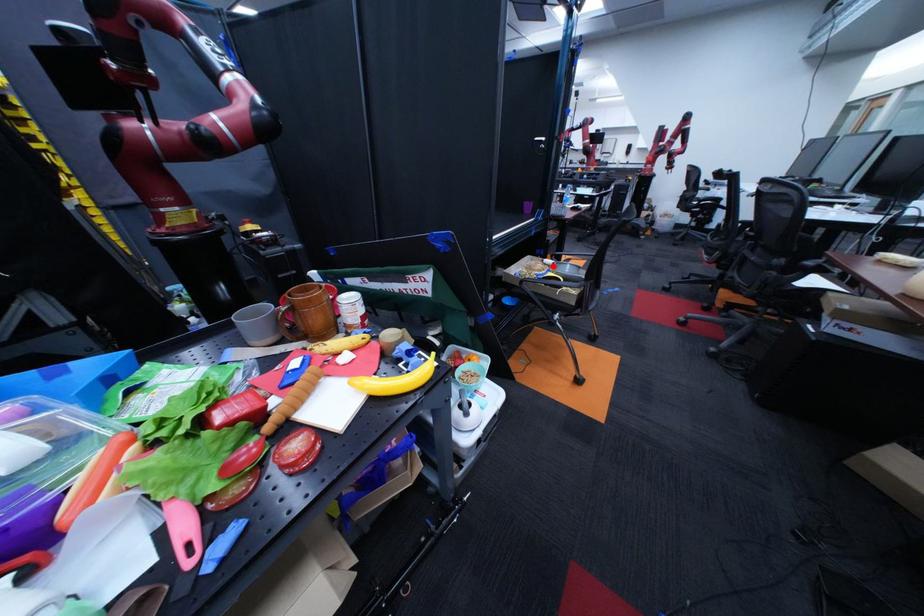
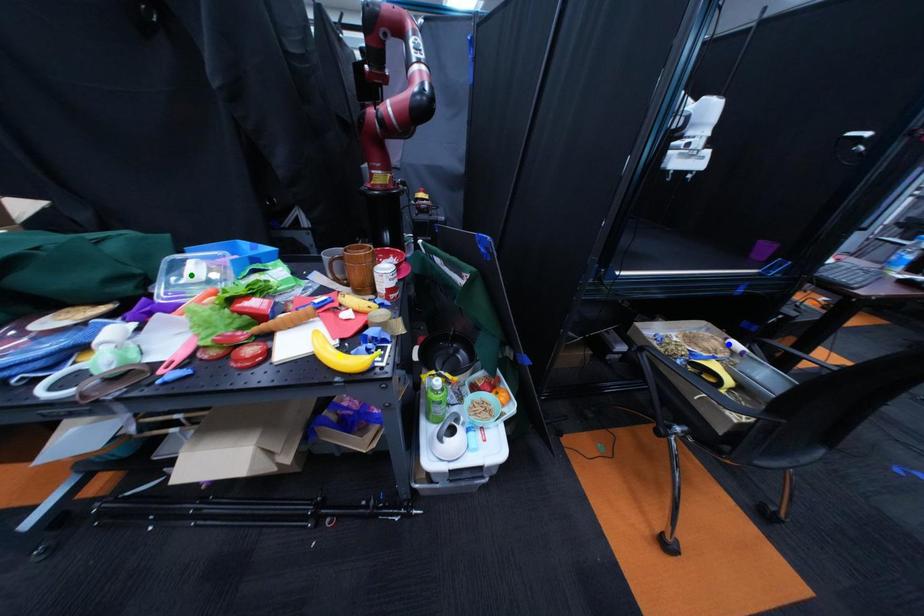
Question: I am providing you with two images of the same scene from different viewpoints. A red point is marked on the first image. You are given multiple points on the second image. Which spot in image 2 lines up with the point in image 1?

Choices:
 (A) green point
 (B) yellow point
 (C) blue point

Answer: (C)